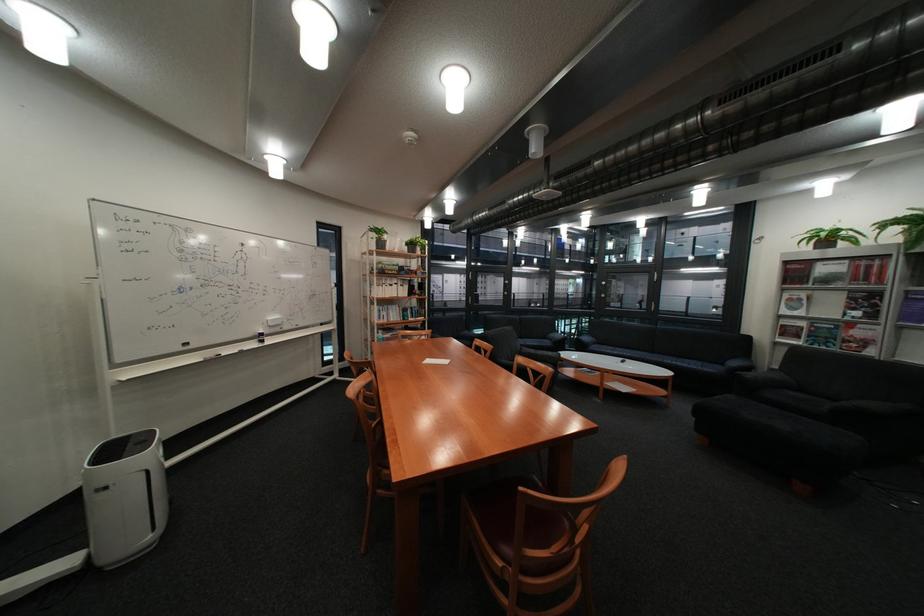
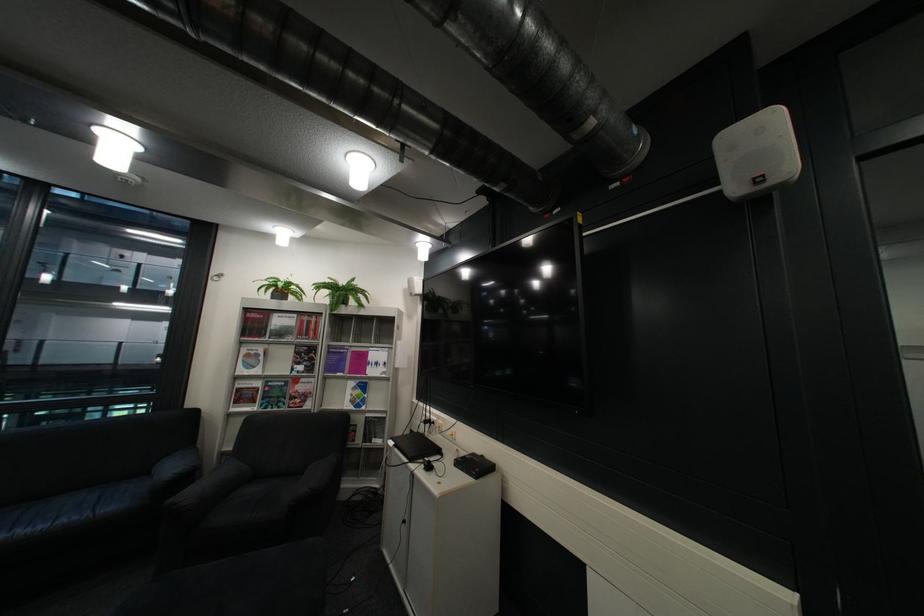
Where in the second image is the point corresponding to point 865,299 from the first image?

(311, 353)